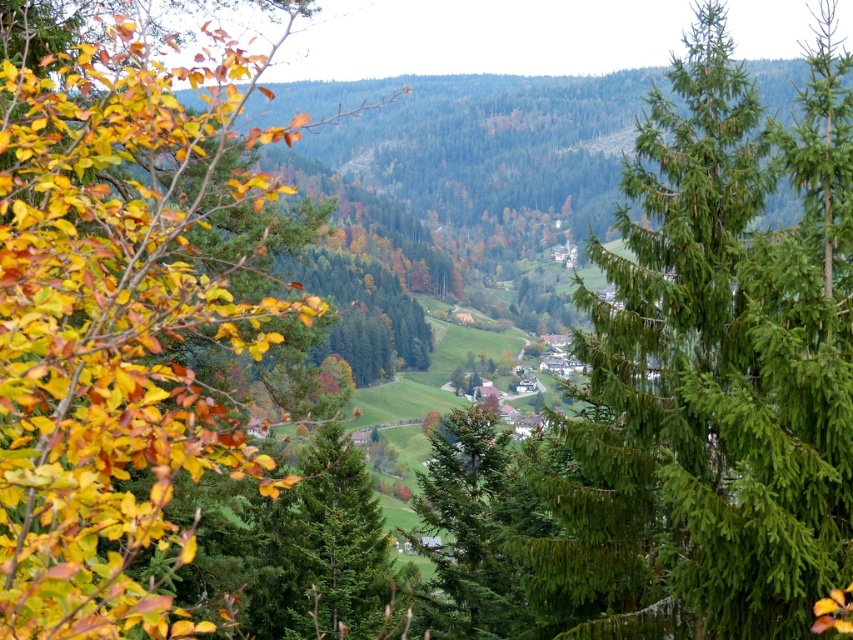
Between point (828, 76) and point (149, 412), which one is positioned behind?

Positioned behind is point (828, 76).

Which of these two, green needle-like at center or yellow-green leaves at left, stands shorter?

Standing shorter between the two is yellow-green leaves at left.

Between point (555, 572) and point (62, 621), which one is positioned in front?

Point (62, 621)

What are the coordinates of `green needle-like at center` in the screenshot? It's located at (712, 371).